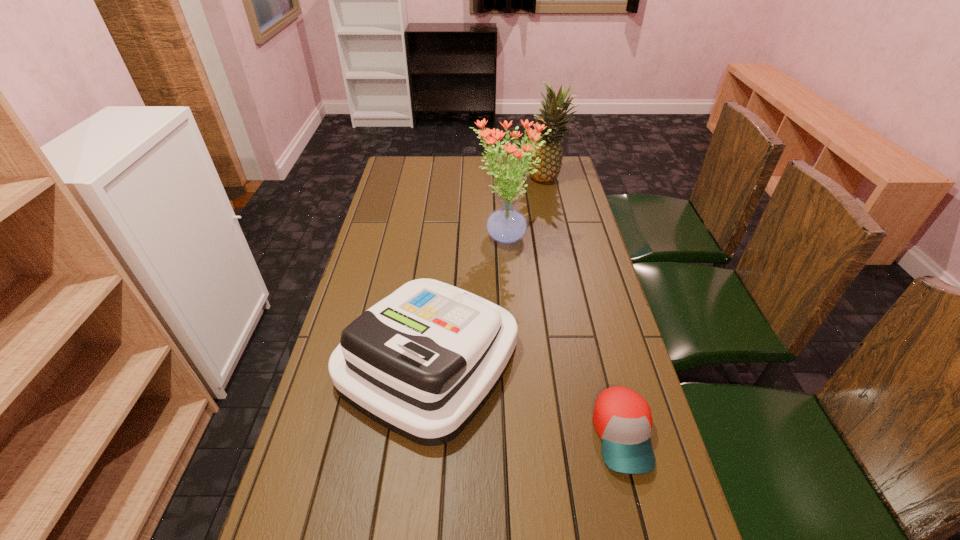
The image size is (960, 540). I want to click on flower arrangement, so click(506, 225).

Where is `pineapple`? Image resolution: width=960 pixels, height=540 pixels. pineapple is located at coordinates (550, 153).

Where is `cash register`? The image size is (960, 540). cash register is located at coordinates (422, 362).

Find the location of a particular element. Image resolution: width=960 pixels, height=540 pixels. baseball cap is located at coordinates (622, 418).

Locate an element on the screen. free location located on the back of the third nearest object is located at coordinates (503, 197).

Find the location of a particular element. free space located on the front of the farthest object is located at coordinates (560, 232).

Locate an element on the screen. This screenshot has height=540, width=960. free region located on the front of the cash register is located at coordinates (416, 478).

This screenshot has width=960, height=540. I want to click on vacant space situated at the brim of the baseball cap, so click(x=646, y=527).

The image size is (960, 540). Identify the location of object that is positioned at the far edge. (550, 153).

You are a GUI agent. You are given a task and a screenshot of the screen. Output one action in this format:
    pyautogui.click(x=<x>, y=<y>)
    Task: Click on the object situated at the left edge
    
    Given the screenshot: What is the action you would take?
    422,362